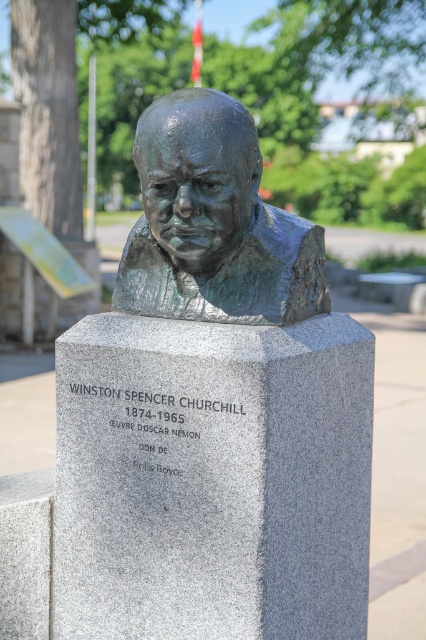
What do you see at coordinates (213, 412) in the screenshot? This screenshot has width=426, height=640. I see `bronze bust at center` at bounding box center [213, 412].

Between bronze bust at center and bronze sculpture at center, which one has less height?

bronze sculpture at center

Locate an element on the screen. bronze bust at center is located at coordinates (213, 412).